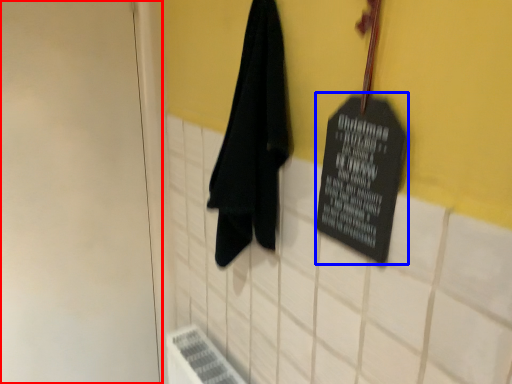
Question: Which of the following is the closest to the observer, door (highlighted by a red box) or bulletin board (highlighted by a blue box)?

Choices:
 (A) door
 (B) bulletin board

Answer: (B)